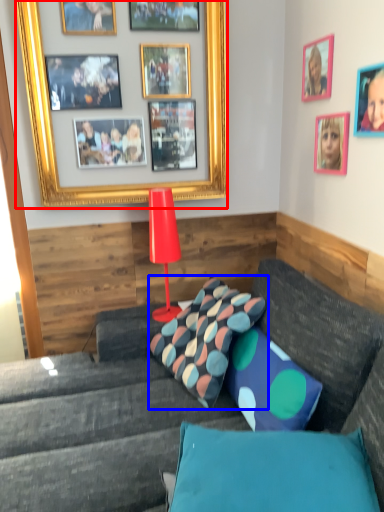
Question: Which of the following is the farthest to the observer, picture frame (highlighted by a red box) or pillow (highlighted by a blue box)?

Choices:
 (A) picture frame
 (B) pillow

Answer: (A)